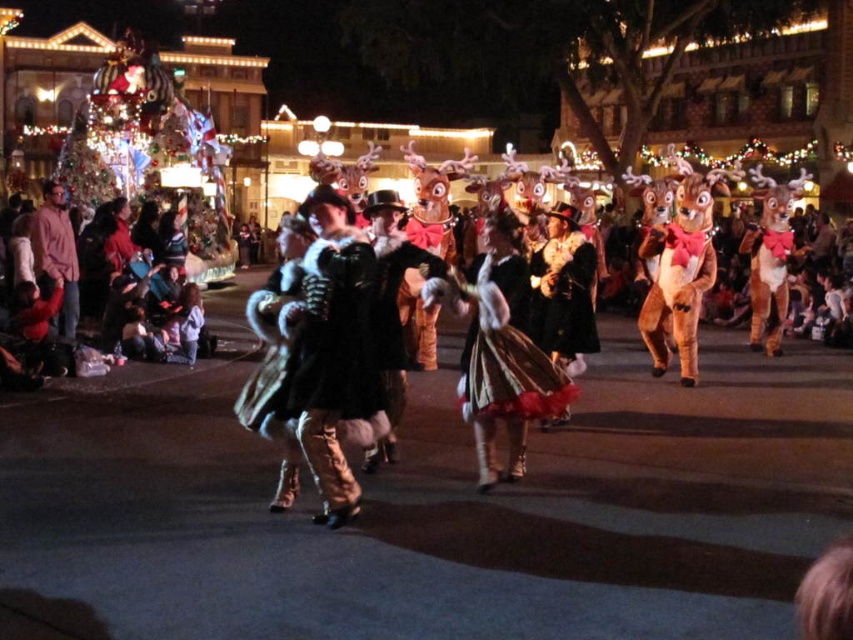
This screenshot has width=853, height=640. What do you see at coordinates (508, 353) in the screenshot? I see `velvet gold dress at center` at bounding box center [508, 353].

Which of these two, velvet gold dress at center or dark clothing at left, stands shorter?

With less height is velvet gold dress at center.

Which is behind, point (509, 305) or point (28, 284)?

Positioned behind is point (28, 284).

The width and height of the screenshot is (853, 640). What are the coordinates of `velvet gold dress at center` in the screenshot? It's located at (508, 353).

Is point (42, 272) behind point (579, 230)?

Yes, it is behind point (579, 230).

I want to click on dark clothing at left, so click(x=45, y=282).

Is point (24, 266) more distant than point (552, 321)?

That is True.

This screenshot has width=853, height=640. What are the coordinates of `dark clothing at left` in the screenshot? It's located at (45, 282).

Is velvet gold dress at center bigger than brown plush squirrel at right?

No, velvet gold dress at center is not bigger than brown plush squirrel at right.

Between velvet gold dress at center and brown plush squirrel at right, which one is positioned lower?

velvet gold dress at center is below.

Which is in front, point (462, 404) or point (654, 321)?

Point (462, 404)

At what (x,y) coordinates should I click in order to perform the action: click on velvet gold dress at center. Please return your answer as a coordinate pair (x, y). Looking at the image, I should click on (508, 353).